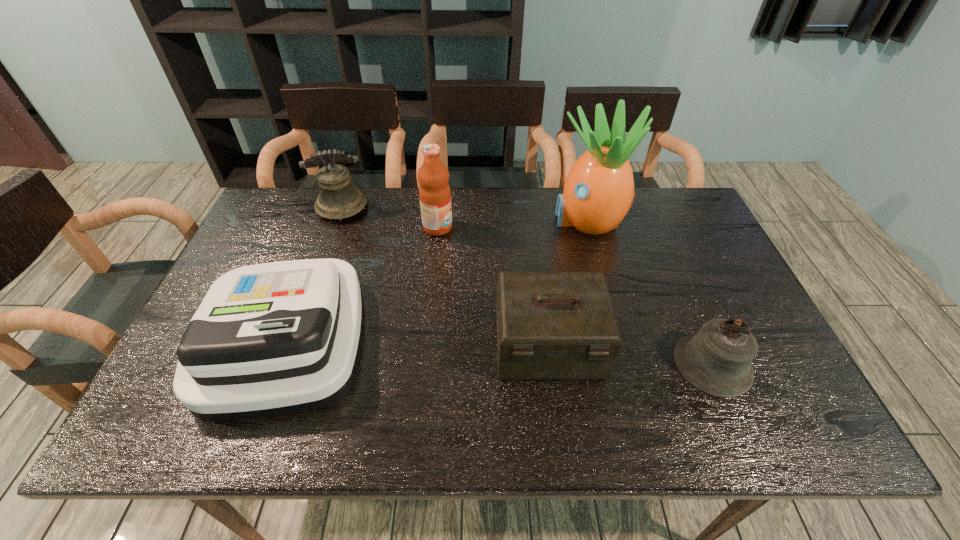
Find the location of `the tallest object`. the tallest object is located at coordinates (598, 192).

Locate an element on the screen. The image size is (960, 540). fruit juice is located at coordinates (434, 191).

This screenshot has width=960, height=540. Find the location of `the second tallest object`. the second tallest object is located at coordinates (434, 191).

The width and height of the screenshot is (960, 540). I want to click on the left bell, so click(x=338, y=199).

Identify the location of the farther bell. (338, 199).

At what (x,y) coordinates should I click in order to perform the action: click on cash register. Please return your answer as a coordinate pair (x, y). Looking at the image, I should click on (271, 339).

The width and height of the screenshot is (960, 540). I want to click on the first-aid kit, so click(550, 325).

You are a GUI agent. You are given a task and a screenshot of the screen. Output one action in this format:
    pyautogui.click(x=<x>, y=<y>)
    Task: Click on the shorter bell
    This screenshot has height=540, width=960.
    Given the screenshot: What is the action you would take?
    pyautogui.click(x=717, y=360)

Where is `the right bell`? Image resolution: width=960 pixels, height=540 pixels. the right bell is located at coordinates (717, 360).

At what (x,y) coordinates should I click in order to perform the action: click on vacant space situated 0.360m at the entrance of the tallest object. Please return your answer as a coordinate pair (x, y). This screenshot has height=540, width=960. Looking at the image, I should click on (438, 219).